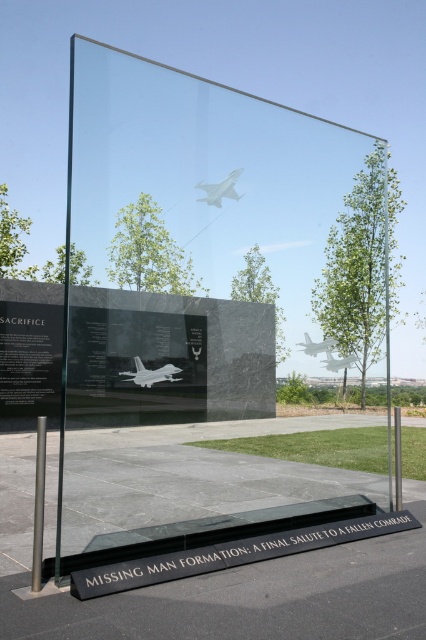
Between black polished stone plaque at lower center and white matte airplane at center, which one is positioned higher?

white matte airplane at center is higher up.

Can you confirm if black polished stone plaque at lower center is shorter than white matte airplane at center?

Correct, black polished stone plaque at lower center is not as tall as white matte airplane at center.

Is point (115, 588) positioned before point (213, 182)?

Yes, point (115, 588) is in front of point (213, 182).

At what (x,y) coordinates should I click in order to perform the action: click on black polished stone plaque at lower center. Please return your answer as a coordinate pair (x, y). The height and width of the screenshot is (640, 426). Looking at the image, I should click on (232, 554).

Is white matte airplane at center behind white glossy airplane at center?

That is True.

Is point (221, 186) positioned in front of point (325, 365)?

No, it is not.

Between point (207, 198) and point (328, 355), which one is positioned behind?

Positioned behind is point (207, 198).

The width and height of the screenshot is (426, 640). What are the coordinates of `white matte airplane at center` in the screenshot? It's located at (219, 189).

What are the coordinates of `matte white airplane at center` in the screenshot? It's located at (150, 372).

Is matte white airplane at center positioned in front of white glossy airplane at center?

Yes, matte white airplane at center is closer to the viewer.

This screenshot has width=426, height=640. Find the location of `matte white airplane at center`. matte white airplane at center is located at coordinates (150, 372).